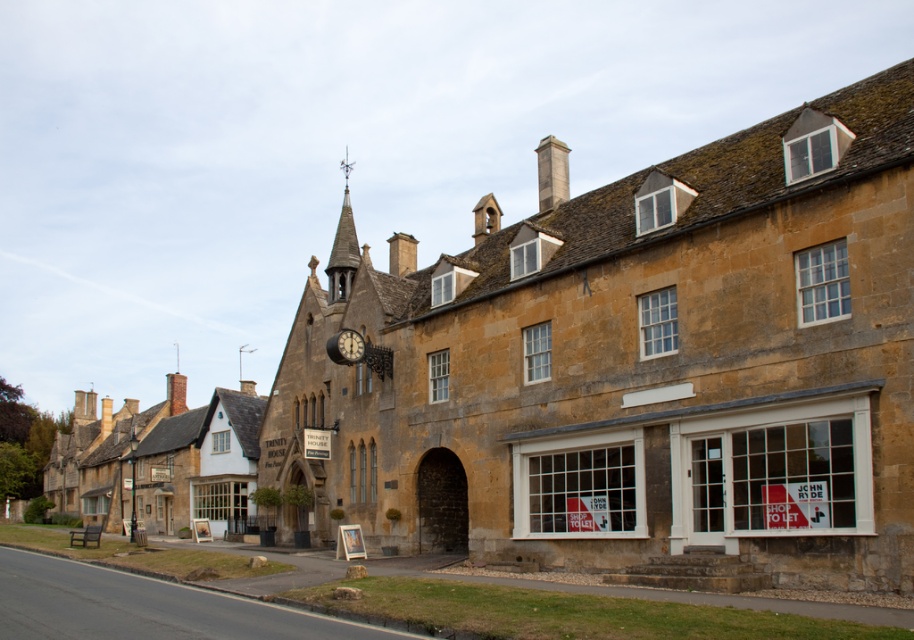
You are an architect assessing the building facade. You notice the smooth stone spire at upper center and the metallic clock at center. Which object would cast a larger shadow during midday when the sun is directly overhead?

The smooth stone spire at upper center might cast a larger shadow than the metallic clock at center because it might be wider.

You are an architect assessing the building for renovations. You need to determine which object, the smooth stone spire at upper center or the metallic clock at center, requires a larger structural support system due to its size. Which one would you prioritize?

The smooth stone spire at upper center requires a larger structural support system because it is bigger than the metallic clock at center.